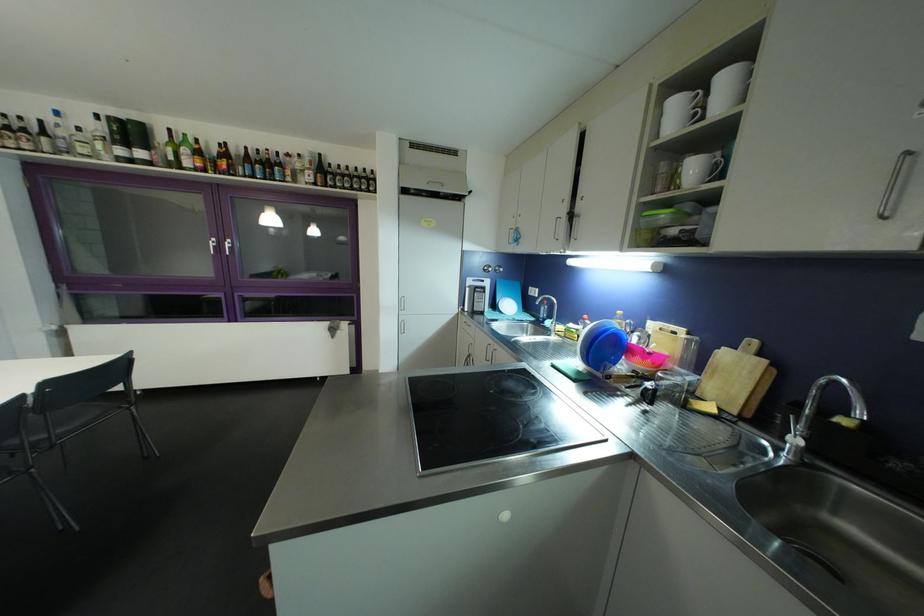
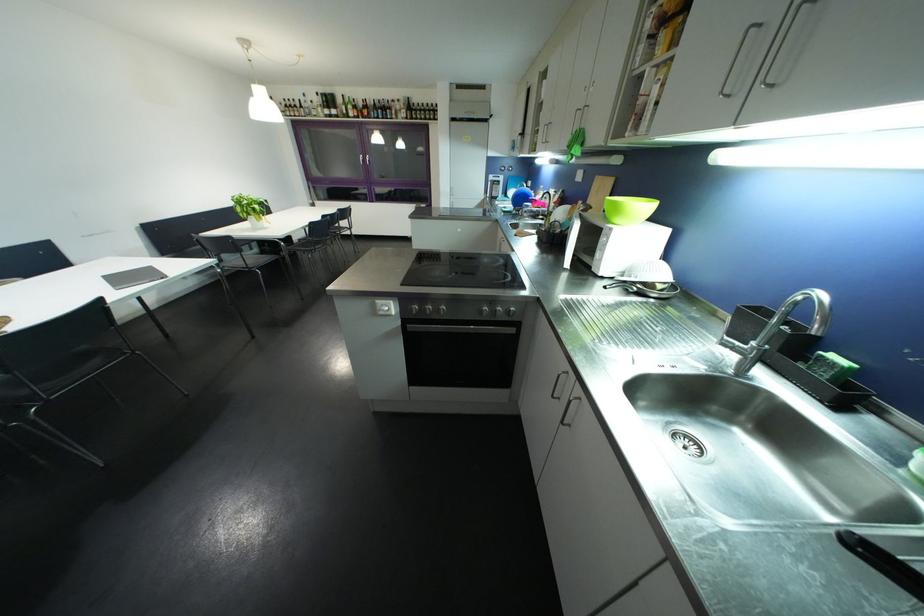
Find the pixel in the second image that matches pixel 349 179 in the first image.

(428, 113)